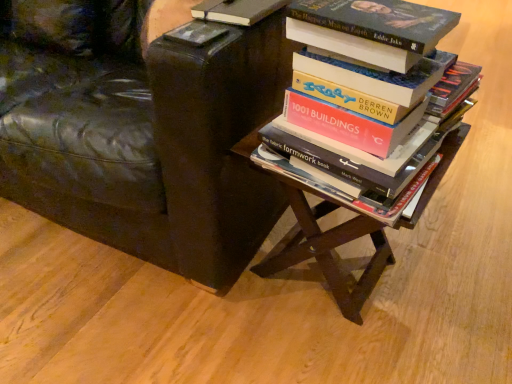
The height and width of the screenshot is (384, 512). Identify the location of free space to the left of wooden table at center. (196, 312).